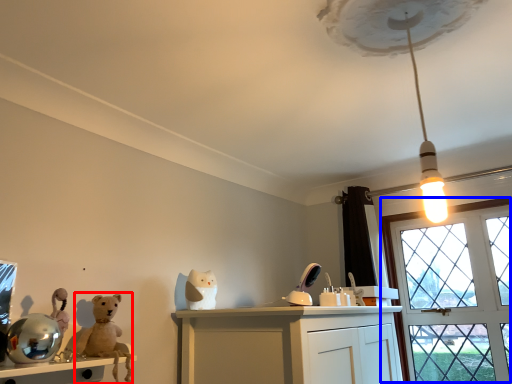
Question: Which object appears closest to the camera in this image, animal (highlighted by a red box) or window (highlighted by a blue box)?

Choices:
 (A) animal
 (B) window

Answer: (A)